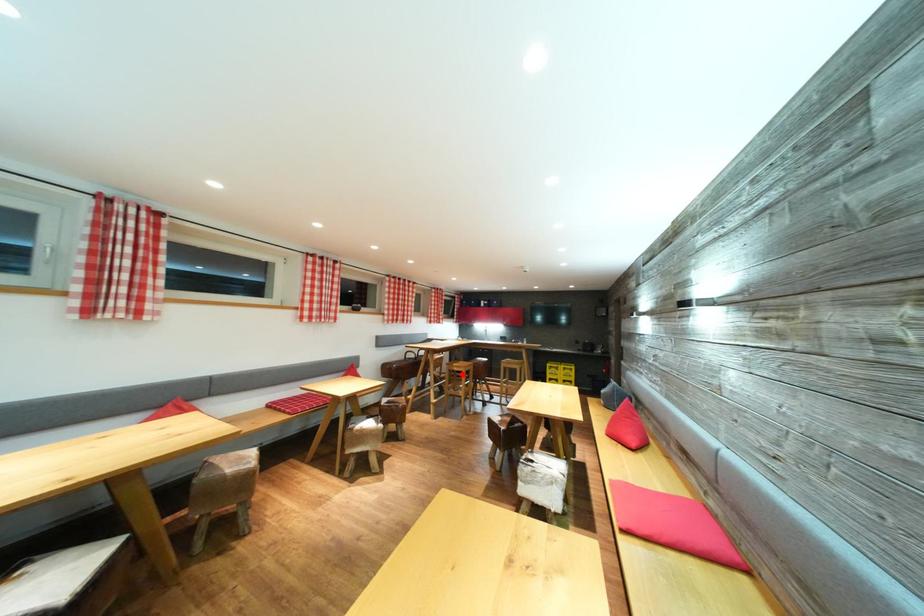
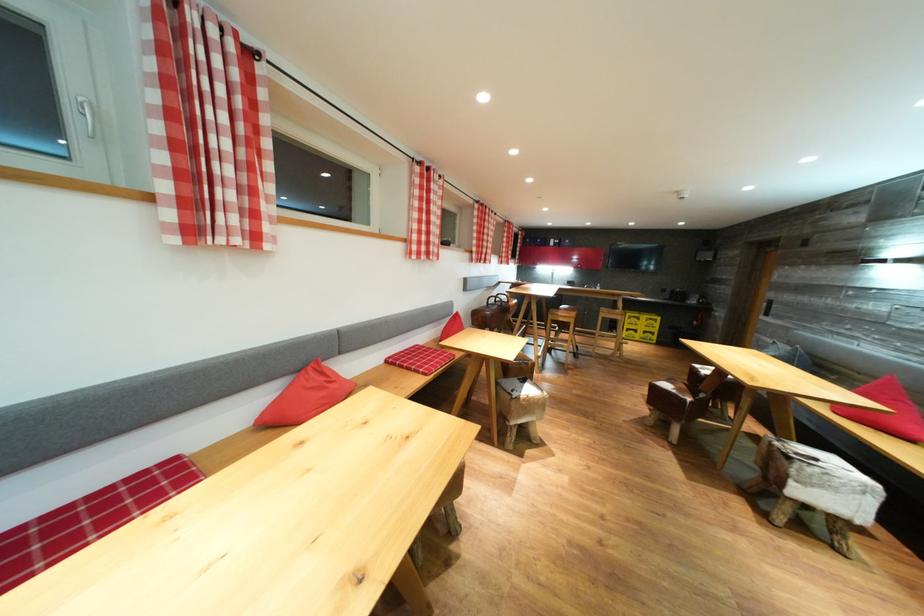
Question: I am providing you with two images of the same scene from different viewpoints. In image1, a red point is highlighted. Considering the same 3D point in image2, which of the following is correct?

Choices:
 (A) It is closer
 (B) It is farther

Answer: (A)